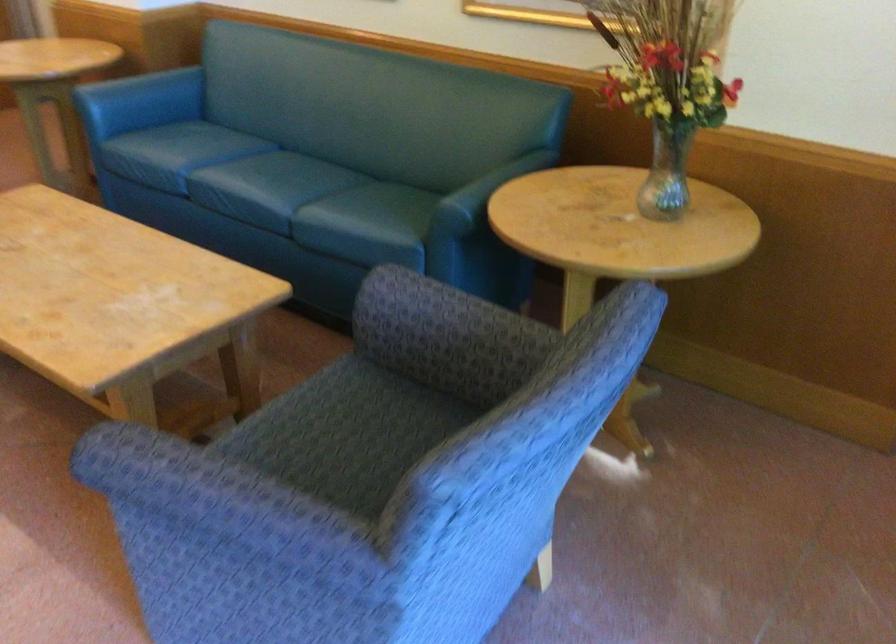
Where would you sit the blue sofa sitting surface? Please return your answer as a coordinate pair (x, y).

(269, 187)